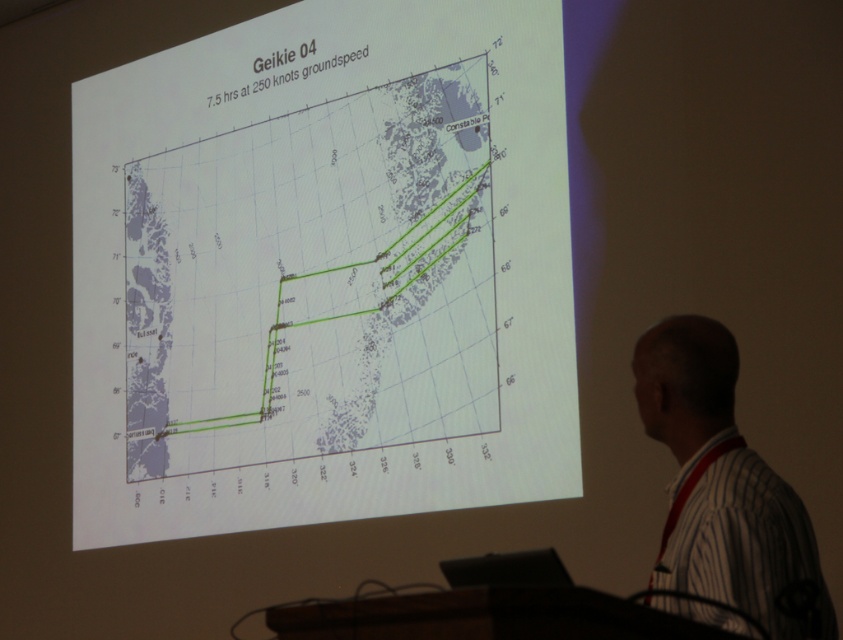
Is green line graph at center closer to the viewer compared to white striped shirt at right?

No, green line graph at center is further to the viewer.

The width and height of the screenshot is (843, 640). I want to click on green line graph at center, so click(x=314, y=282).

Identify the location of green line graph at center. This screenshot has height=640, width=843. (314, 282).